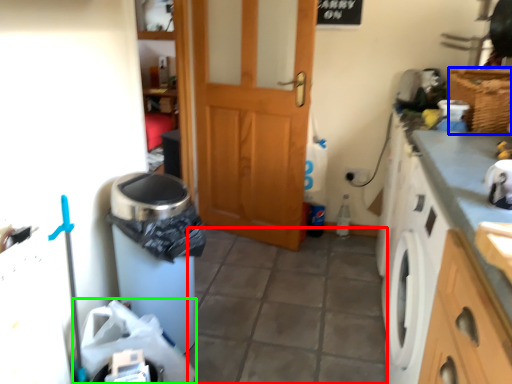
Question: Based on their relative distances, which object is farther from tile (highlighted by a red box)? Choose from basket (highlighted by a blue box) and garbage (highlighted by a green box).

Choices:
 (A) basket
 (B) garbage

Answer: (A)